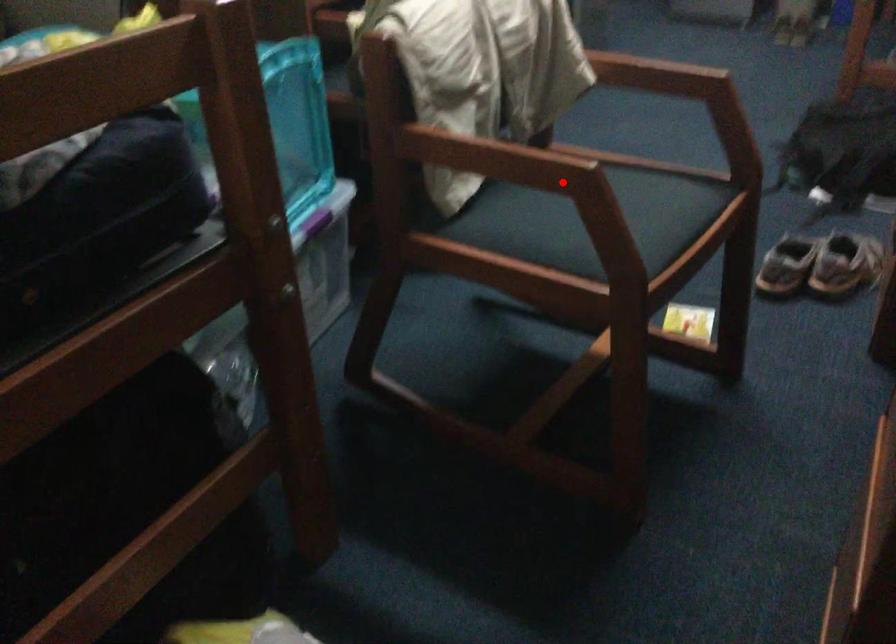
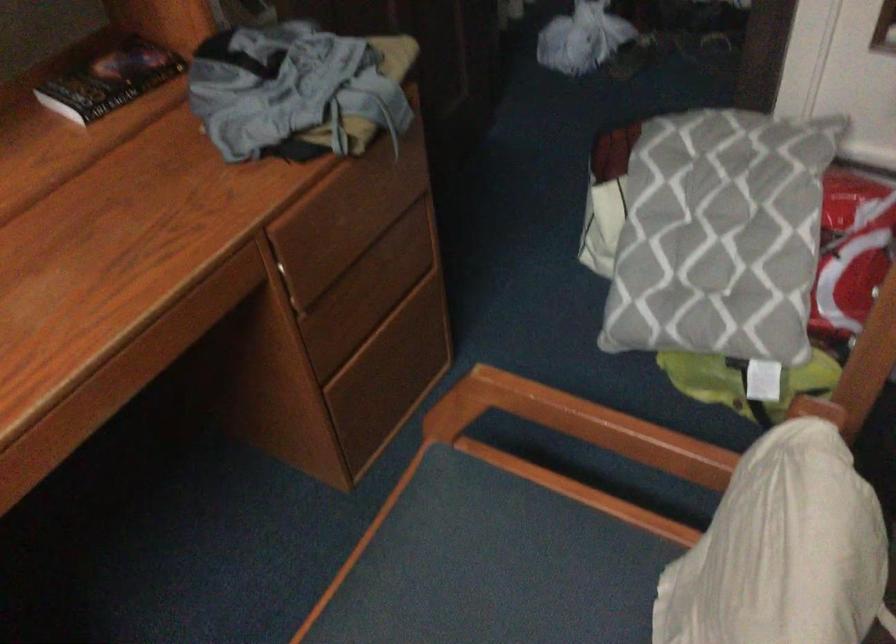
Question: I am providing you with two images of the same scene from different viewpoints. A red point is shown in image1. For the corresponding object point in image2, is it positioned nearer or farther from the camera?

Choices:
 (A) Nearer
 (B) Farther

Answer: (A)